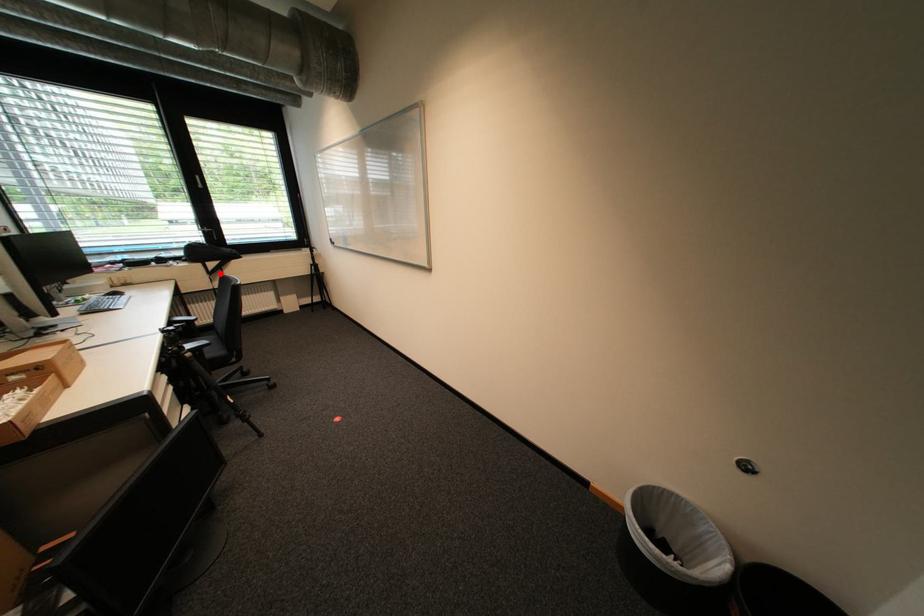
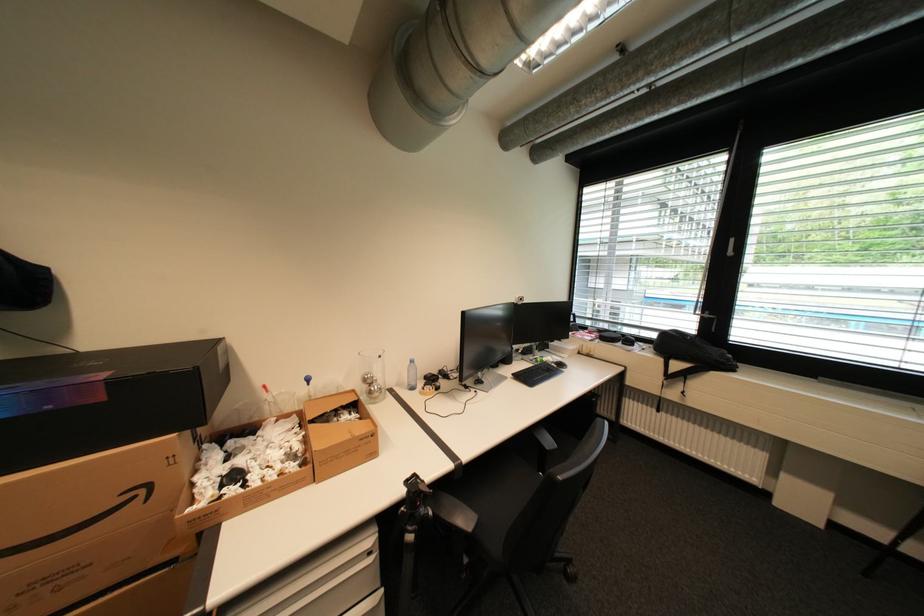
Question: I am providing you with two images of the same scene from different viewpoints. Image1 has a red point marked. In image2, the corresponding 3D location appears at what relative position? Reply with the corresponding letter.

Choices:
 (A) Closer
 (B) Farther

Answer: (A)